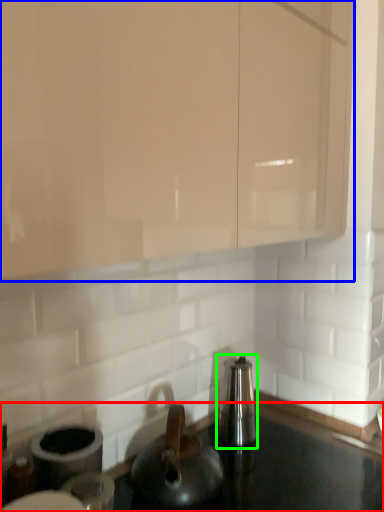
Question: Estimate the real-world distances between objects in this image. Which object is closer to countertop (highlighted by a red box), cabinetry (highlighted by a blue box) or appliance (highlighted by a green box)?

Choices:
 (A) cabinetry
 (B) appliance

Answer: (B)